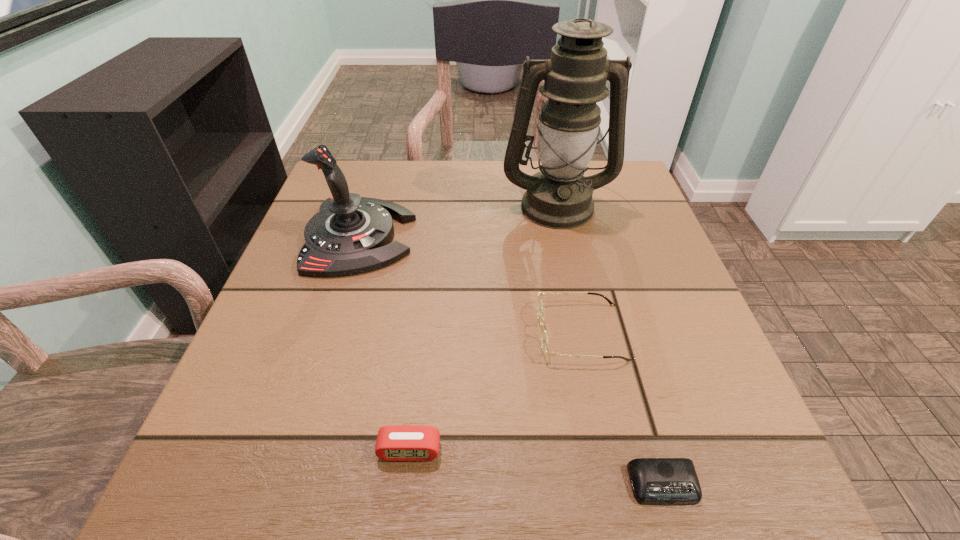
Identify the location of object at the far right corner. The height and width of the screenshot is (540, 960). (559, 196).

The width and height of the screenshot is (960, 540). I want to click on object that is positioned at the near right corner, so click(657, 481).

In order to click on blank space at the far edge of the desktop in this screenshot , I will do `click(415, 200)`.

I want to click on vacant space at the near edge, so click(315, 508).

Identify the location of free location at the left edge. The width and height of the screenshot is (960, 540). (302, 290).

In the image, there is a desktop. What are the coordinates of `blank space at the right edge` in the screenshot? It's located at (640, 245).

The height and width of the screenshot is (540, 960). Identify the location of vacant space at the far right corner of the desktop. (592, 166).

This screenshot has height=540, width=960. I want to click on vacant space at the near right corner of the desktop, so click(x=669, y=451).

You are a GUI agent. You are given a task and a screenshot of the screen. Output one action in this format:
    pyautogui.click(x=<x>, y=<y>)
    Task: Click on the vacant area that lies between the spectacles and the shortest object
    
    Given the screenshot: What is the action you would take?
    pyautogui.click(x=622, y=408)

This screenshot has height=540, width=960. I want to click on unoccupied position between the fourth farthest object and the nearer alarm clock, so click(537, 468).